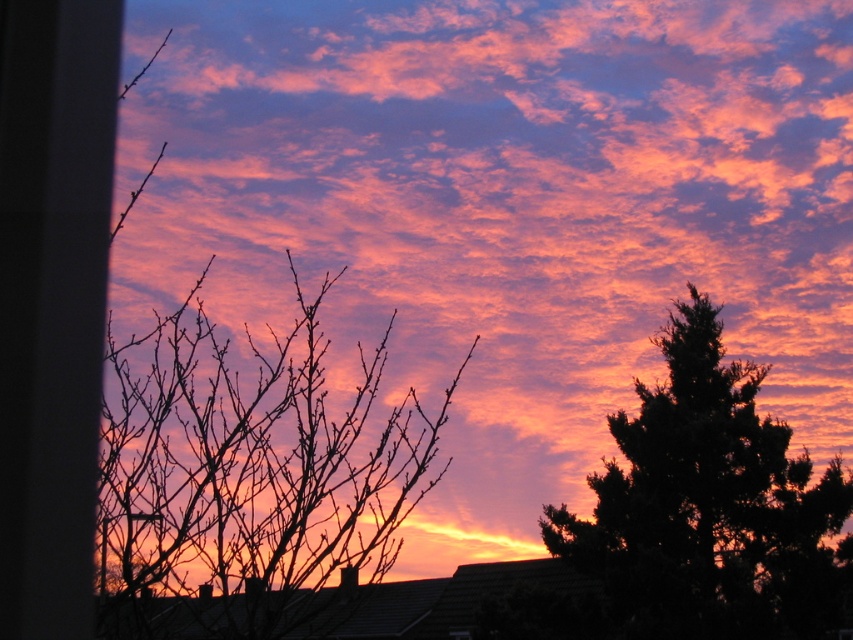
Question: Does silhouette branches at left have a larger size compared to dark green textured tree at right?

Choices:
 (A) yes
 (B) no

Answer: (B)

Question: Which point is farther to the camera?

Choices:
 (A) (631, 580)
 (B) (277, 429)

Answer: (A)

Question: Does silhouette branches at left appear on the left side of dark green textured tree at right?

Choices:
 (A) yes
 (B) no

Answer: (A)

Question: Among these points, which one is farthest from the camera?

Choices:
 (A) (614, 477)
 (B) (373, 381)

Answer: (A)

Question: Is silhouette branches at left smaller than dark green textured tree at right?

Choices:
 (A) no
 (B) yes

Answer: (B)

Question: Which point is farther to the camera?

Choices:
 (A) silhouette branches at left
 (B) dark green textured tree at right

Answer: (B)